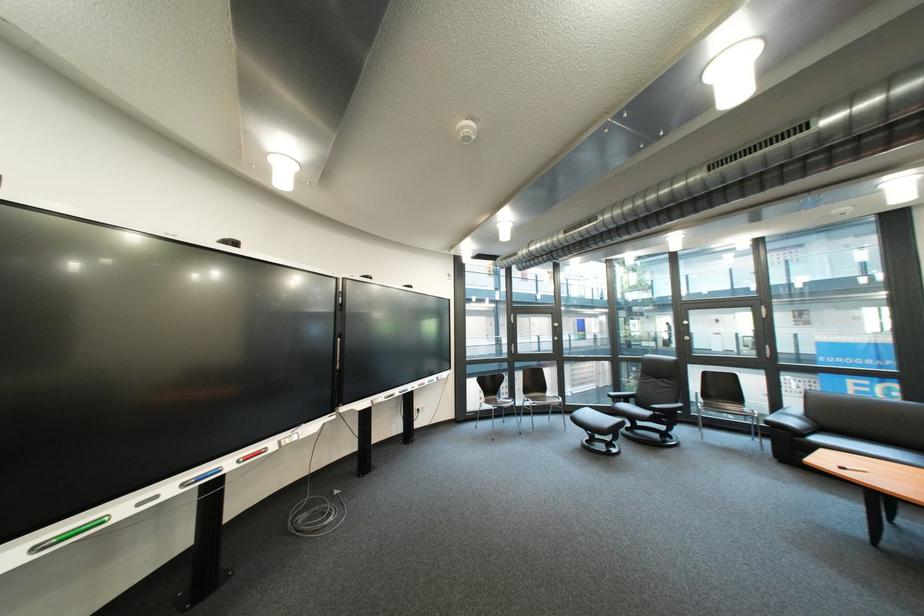
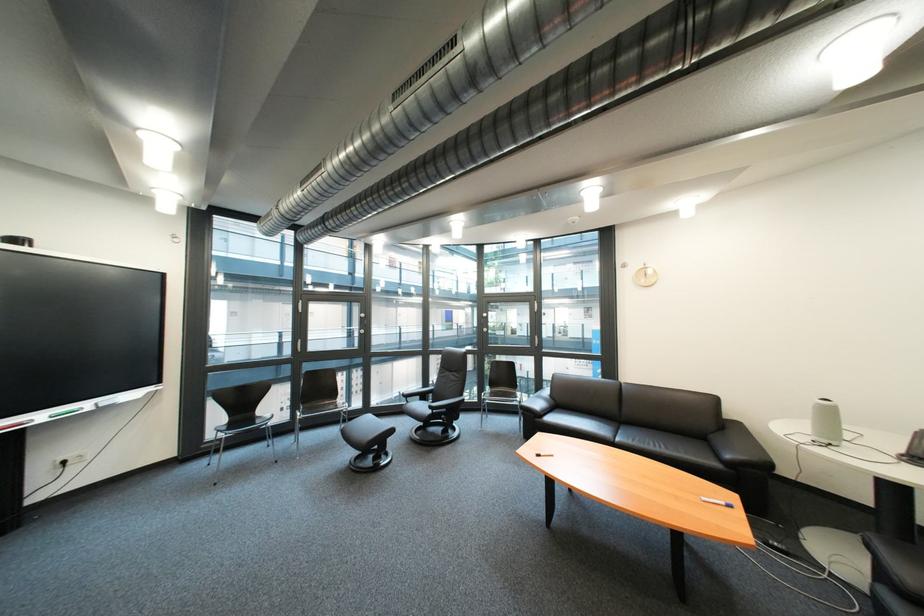
Locate, in the second image, the point that corresponds to [447,379] in the first image.

(101, 406)